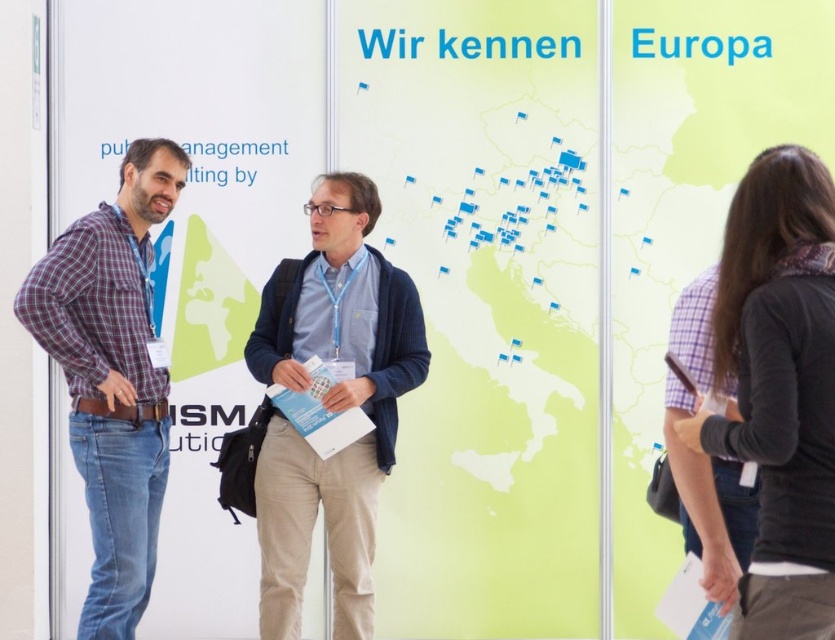
You are attending a conference and want to approach the person wearing the plaid cotton shirt at left to ask a question. From your current position, which direction should you move to reach them first before the person in the blue corduroy sweater at center?

Since the blue corduroy sweater at center is positioned under the plaid cotton shirt at left, the plaid cotton shirt at left is higher up or in a more forward position. Therefore, you should move towards the left direction to reach the person in the plaid cotton shirt at left first before the person in the blue corduroy sweater at center.

You are at a conference and need to locate the black sweater at right. According to the coordinates given, where should you look on the image?

The black sweater at right is located at point coordinates [778,387] on the image.